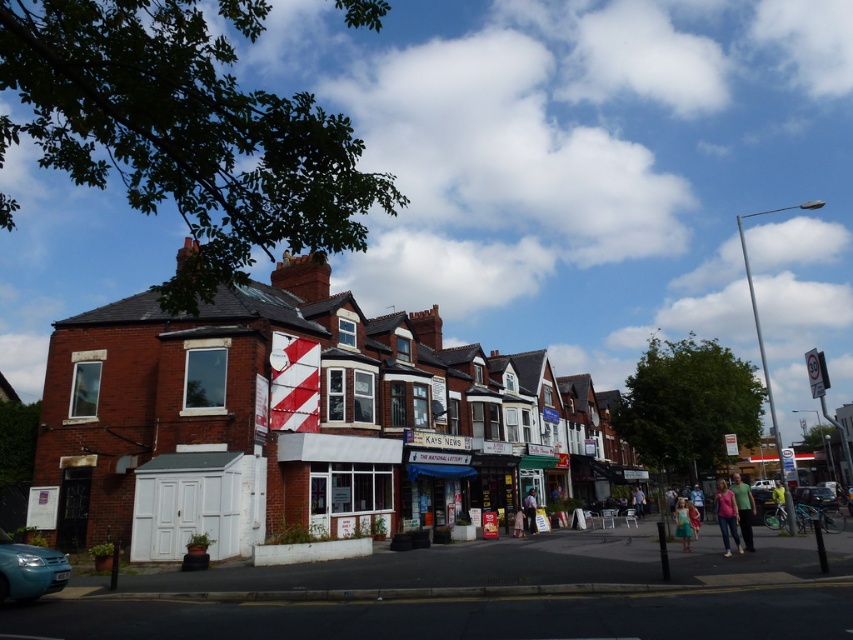
You are a fashion designer observing the vibrant street scene. You notice two items of clothing at the lower right corner of the image. Which clothing item is positioned higher between the green cotton shirt at lower right and the yellow fabric jacket at lower right?

The green cotton shirt at lower right is positioned higher than the yellow fabric jacket at lower right according to the description.

You are a window cleaner standing on the sidewalk and see the red brick building at center and the green fabric dress at lower center. Which object would require you to use a ladder to clean its windows?

The red brick building at center is much taller than the green fabric dress at lower center, so you would need a ladder to clean its windows.